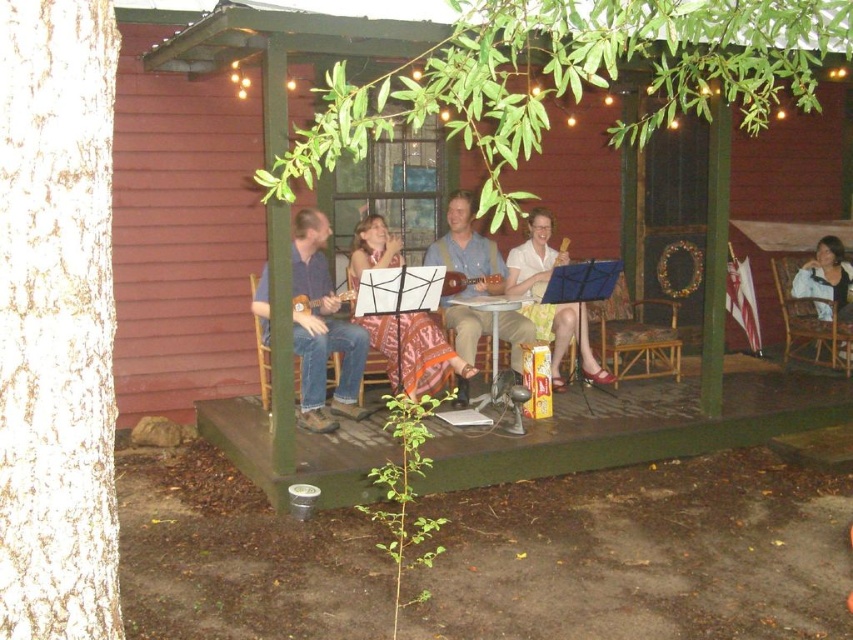
Question: Can you confirm if wicker chair at right is positioned above brown wooden ukulele at center?

Choices:
 (A) yes
 (B) no

Answer: (B)

Question: Which point appears farthest from the camera in this image?

Choices:
 (A) (474, 368)
 (B) (270, 401)
 (C) (543, 246)
 (D) (477, 276)

Answer: (C)

Question: Based on their relative distances, which object is nearer to the light brown wooden ukulele at center?

Choices:
 (A) denim jeans at center
 (B) brown wooden ukulele at center
 (C) wooden chair at center

Answer: (B)

Question: Can you confirm if wooden cabin at center is positioned below wooden chair at center?

Choices:
 (A) no
 (B) yes

Answer: (A)

Question: Is denim jeans at center thinner than wicker chair at right?

Choices:
 (A) no
 (B) yes

Answer: (A)

Question: Which point is closer to the camera?

Choices:
 (A) green wooden porch at center
 (B) wicker chair at right

Answer: (A)